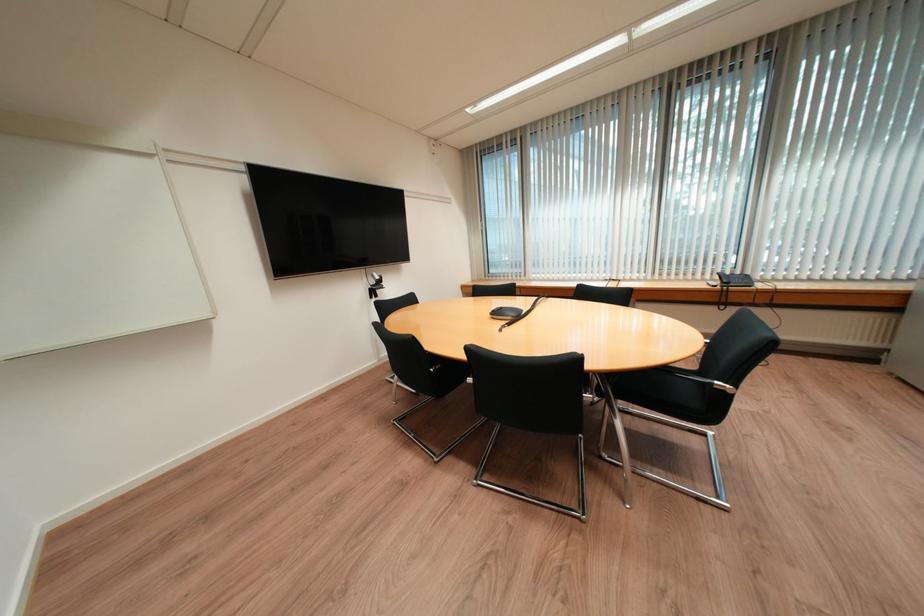
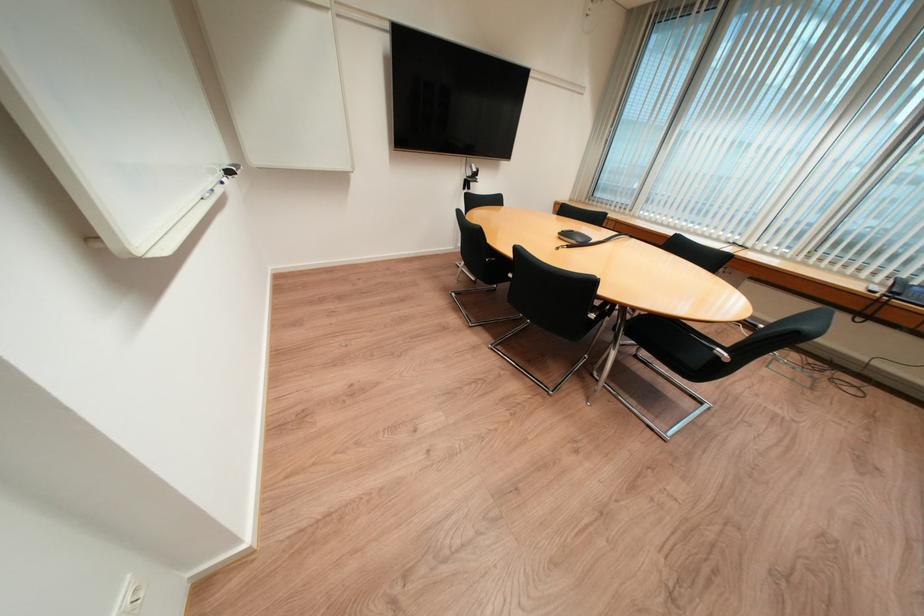
In the second image, find the point that corresponds to [505,315] in the first image.

(574, 236)